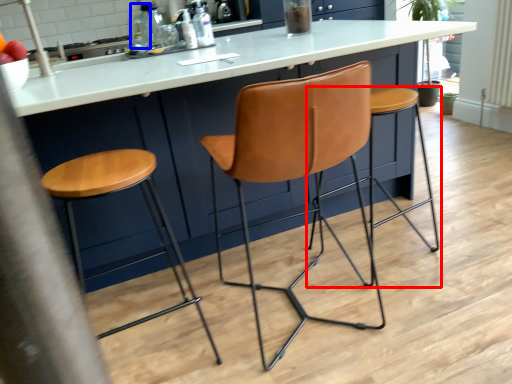
Question: Which object appears closest to the camera in this image, stool (highlighted by a red box) or bottle (highlighted by a blue box)?

Choices:
 (A) stool
 (B) bottle

Answer: (A)